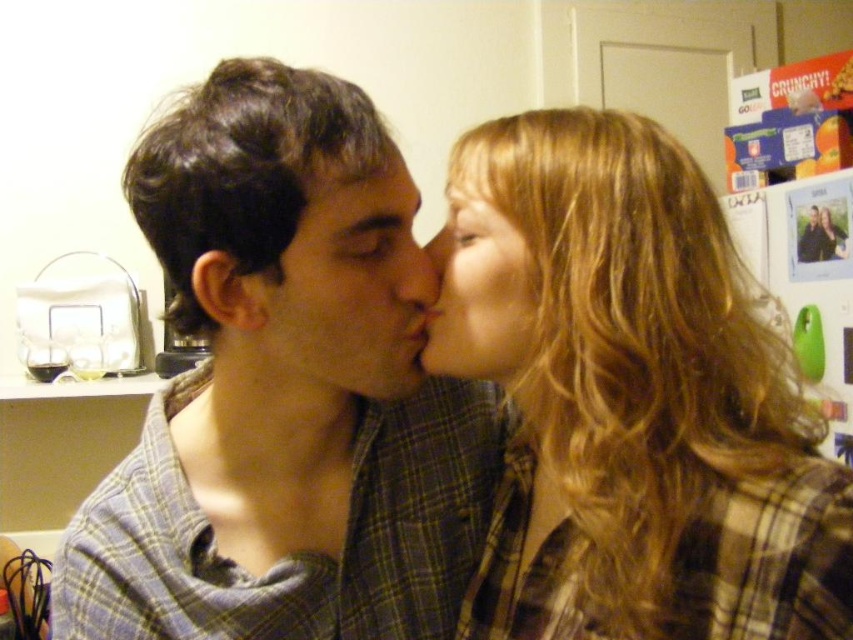
Question: Is plaid shirt at center to the left of smooth skin nose at center from the viewer's perspective?

Choices:
 (A) yes
 (B) no

Answer: (A)

Question: Which point is closer to the camera taking this photo?

Choices:
 (A) (357, 205)
 (B) (415, 288)
 (C) (491, 362)
 (D) (643, 264)

Answer: (A)

Question: Which object appears closest to the camera in this image?

Choices:
 (A) smooth skin nose at center
 (B) blonde hair at center

Answer: (B)

Question: Which of the following is the farthest from the observer?

Choices:
 (A) matte plaid shirt at center
 (B) smooth skin face at center

Answer: (B)

Question: Does smooth skin face at center lie behind blonde hair at upper center?

Choices:
 (A) no
 (B) yes

Answer: (A)

Question: Does blonde hair at center appear under smooth skin nose at center?

Choices:
 (A) yes
 (B) no

Answer: (A)